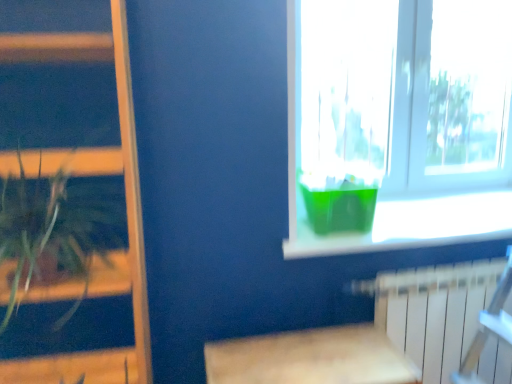
Question: Is green translucent vase at window completely or partially inside wooden bookshelf at left?

Choices:
 (A) no
 (B) yes

Answer: (A)

Question: Is wooden bookshelf at left turned away from green translucent vase at window?

Choices:
 (A) yes
 (B) no

Answer: (B)

Question: Is wooden bookshelf at left not close to green translucent vase at window?

Choices:
 (A) yes
 (B) no

Answer: (B)

Question: Is wooden bookshelf at left oriented towards green translucent vase at window?

Choices:
 (A) yes
 (B) no

Answer: (B)

Question: From a real-world perspective, is wooden bookshelf at left on top of green translucent vase at window?

Choices:
 (A) yes
 (B) no

Answer: (B)

Question: Would you say green leafy plant at left is to the left or to the right of wooden bookshelf at left in the picture?

Choices:
 (A) left
 (B) right

Answer: (B)

Question: From a real-world perspective, is green leafy plant at left physically located above or below wooden bookshelf at left?

Choices:
 (A) above
 (B) below

Answer: (A)

Question: In the image, is green leafy plant at left positioned in front of or behind wooden bookshelf at left?

Choices:
 (A) behind
 (B) front

Answer: (A)

Question: From the image's perspective, is green leafy plant at left located above or below wooden bookshelf at left?

Choices:
 (A) above
 (B) below

Answer: (A)

Question: In terms of width, does green plastic container at upper right look wider or thinner when compared to transparent plastic container at upper right?

Choices:
 (A) thin
 (B) wide

Answer: (B)

Question: Is point (338, 236) positioned closer to the camera than point (384, 1)?

Choices:
 (A) farther
 (B) closer

Answer: (B)

Question: In terms of height, does green plastic container at upper right look taller or shorter compared to transparent plastic container at upper right?

Choices:
 (A) tall
 (B) short

Answer: (B)

Question: From a real-world perspective, relative to transparent plastic container at upper right, is green plastic container at upper right vertically above or below?

Choices:
 (A) above
 (B) below

Answer: (B)

Question: In terms of height, does transparent plastic container at upper right look taller or shorter compared to wooden bookshelf at left?

Choices:
 (A) tall
 (B) short

Answer: (B)

Question: Considering the positions of transparent plastic container at upper right and wooden bookshelf at left in the image, is transparent plastic container at upper right wider or thinner than wooden bookshelf at left?

Choices:
 (A) thin
 (B) wide

Answer: (A)